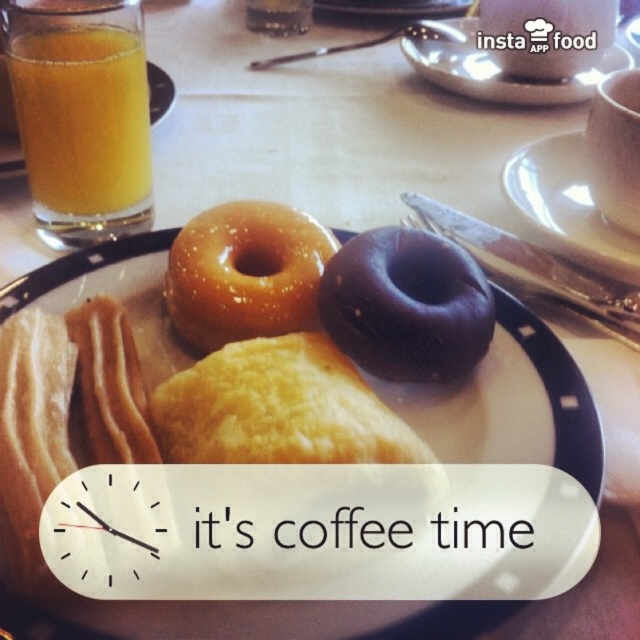
Does matte glazed donuts at center have a lesser width compared to translucent glass mug at upper left?

Incorrect, matte glazed donuts at center's width is not less than translucent glass mug at upper left's.

You are a GUI agent. You are given a task and a screenshot of the screen. Output one action in this format:
    pyautogui.click(x=<x>, y=<y>)
    Task: Click on the matte glazed donuts at center
    This screenshot has height=640, width=640.
    Given the screenshot: What is the action you would take?
    pyautogui.click(x=557, y=394)

Which is behind, point (486, 333) or point (536, 65)?

Positioned behind is point (536, 65).

Is chocolate glazed donut at center above translucent glass mug at upper left?

No.

Does point (344, 275) come behind point (481, 3)?

No, (344, 275) is closer to viewer.

Where is `chocolate glazed donut at center`? The image size is (640, 640). chocolate glazed donut at center is located at coordinates (406, 305).

Which is above, translucent glass orange juice at upper left or chocolate glazed donut at center?

translucent glass orange juice at upper left

Which of these two, translucent glass orange juice at upper left or chocolate glazed donut at center, stands taller?

Standing taller between the two is translucent glass orange juice at upper left.

The height and width of the screenshot is (640, 640). What do you see at coordinates (83, 116) in the screenshot?
I see `translucent glass orange juice at upper left` at bounding box center [83, 116].

Identify the location of translucent glass orange juice at upper left. This screenshot has height=640, width=640. (83, 116).